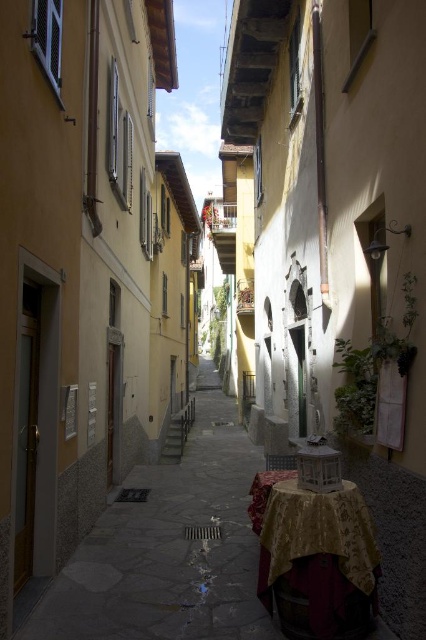
You are a delivery person with a cart that is 1.2 meters wide. You need to navigate through the narrow alleyway shown in the image. Can your cart fit through the space between the smooth stone path at center and the gold textured tablecloth at lower right?

The smooth stone path at center is wider than the gold textured tablecloth at lower right. Since the cart is 1.2 meters wide, it depends on the actual width of the path. However, the description only states that the path is wider than the tablecloth but does not provide specific measurements. Without knowing the exact width of the path, it is impossible to determine if the cart will fit.

You are a tourist walking down the narrow alleyway and want to place a small potted plant between the smooth stone path at center and the gold textured tablecloth at lower right. Based on their positions, where should you place the potted plant?

You should place the potted plant to the left of the gold textured tablecloth at lower right since the smooth stone path at center is already positioned to its left.